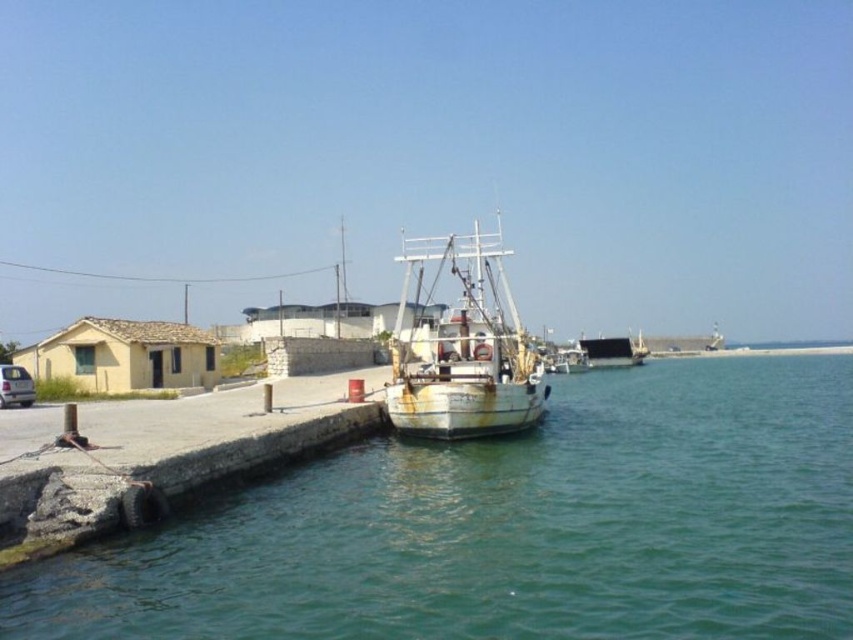
Does green water at center appear under rusty metal boat at center?

Indeed, green water at center is positioned under rusty metal boat at center.

Is green water at center behind rusty metal boat at center?

No.

Locate an element on the screen. green water at center is located at coordinates (511, 528).

Is point (102, 442) farther from viewer compared to point (485, 406)?

No, it is not.

Measure the distance between rusty concrete dock at lower left and camera.

They are 10.93 meters apart.

At what (x,y) coordinates should I click in order to perform the action: click on rusty concrete dock at lower left. Please return your answer as a coordinate pair (x, y). The image size is (853, 640). Looking at the image, I should click on (193, 438).

Is green water at center above rusty concrete dock at lower left?

Actually, green water at center is below rusty concrete dock at lower left.

Does green water at center appear under rusty concrete dock at lower left?

Yes, green water at center is below rusty concrete dock at lower left.

This screenshot has width=853, height=640. What do you see at coordinates (511, 528) in the screenshot? I see `green water at center` at bounding box center [511, 528].

At what (x,y) coordinates should I click in order to perform the action: click on green water at center. Please return your answer as a coordinate pair (x, y). The height and width of the screenshot is (640, 853). Looking at the image, I should click on (511, 528).